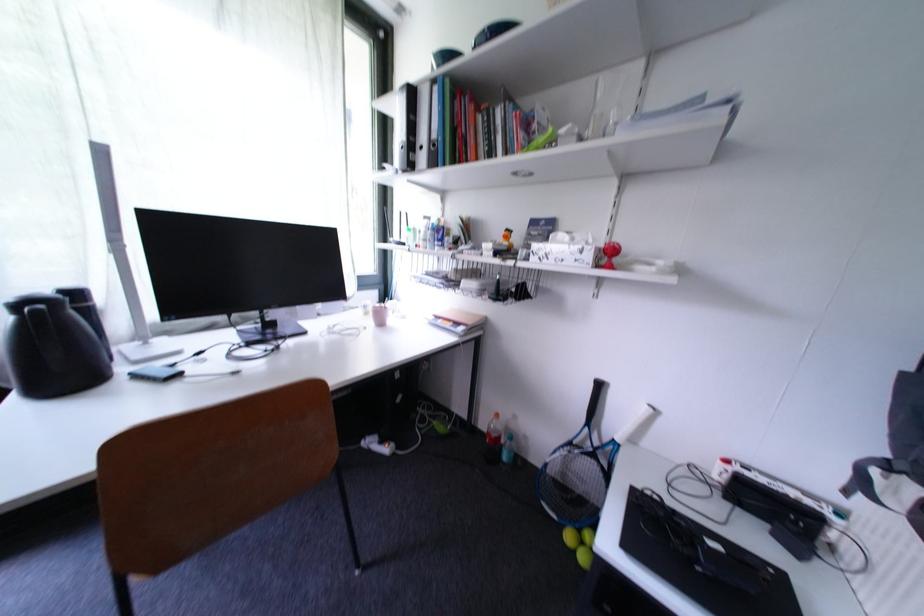
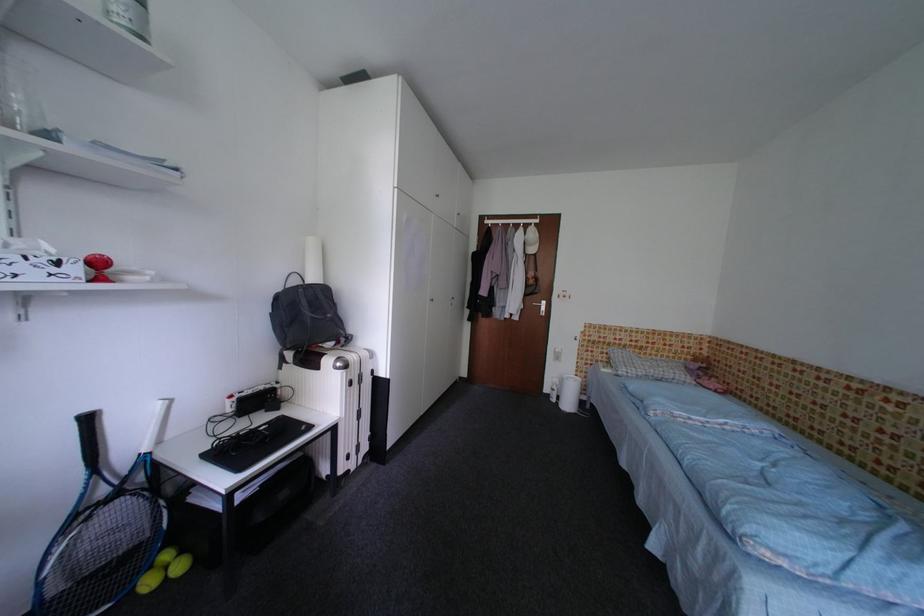
In the second image, find the point that corresponds to (578,540) in the first image.

(156, 586)